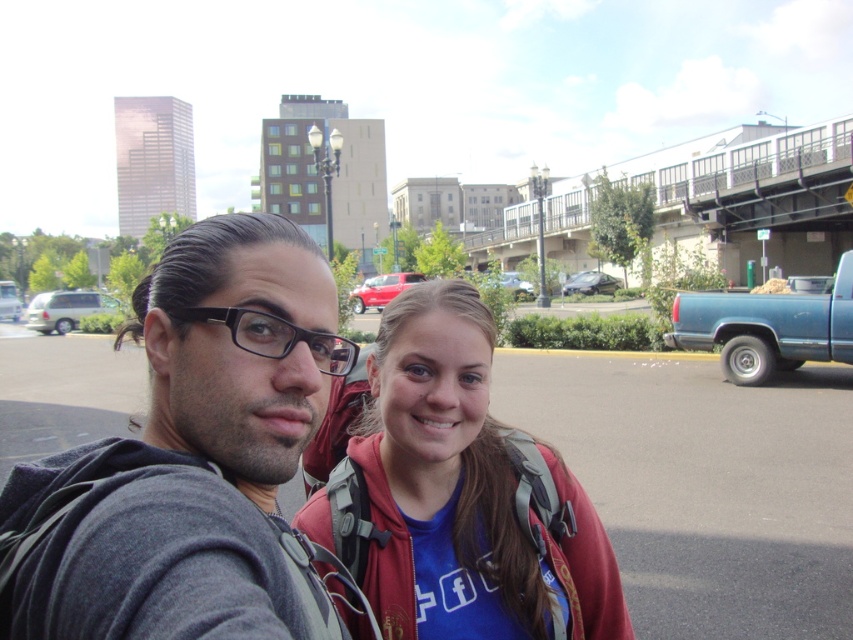
Based on the photo, you are a photographer adjusting your camera settings. You notice the gray fabric hoodie at center and the satin black sedan at center in your frame. Which object appears shorter in the photo?

The gray fabric hoodie at center appears shorter than the satin black sedan at center in the photo.

You are holding a camera and want to take a closeup shot of the gray fabric hoodie at center without moving the camera. Can you zoom in enough to capture the hoodie clearly?

The gray fabric hoodie at center is 20.70 inches away from viewer, so yes, you can zoom in enough to capture the hoodie clearly without moving the camera.

You are a delivery driver who needs to pick up a package from a silver minivan parked at the left side of the scene. The GPS shows a specific point at coordinates point (x=67, y=308). Is this point located on the matte silver minivan at left?

Yes, the point (x=67, y=308) is located on the matte silver minivan at left, so the GPS coordinates are correct.